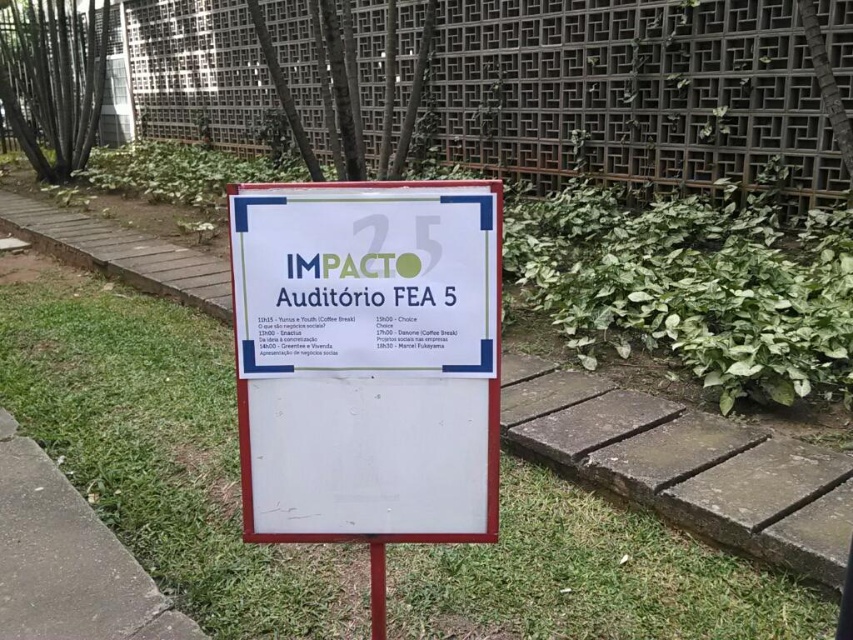
Question: Among these objects, which one is farthest from the camera?

Choices:
 (A) metallic grid fence at upper center
 (B) green grass at lower left
 (C) metallic red post at center
 (D) green grass at center

Answer: (A)

Question: Estimate the real-world distances between objects in this image. Which object is closer to the green grass at center?

Choices:
 (A) metallic grid fence at upper center
 (B) white paper sign at center

Answer: (B)

Question: Which point is farther from the camera taking this photo?

Choices:
 (A) (103, 621)
 (B) (640, 12)

Answer: (B)

Question: Does green grass at center appear over green grass at lower left?

Choices:
 (A) no
 (B) yes

Answer: (B)

Question: Does green grass at center have a lesser width compared to green grass at lower left?

Choices:
 (A) no
 (B) yes

Answer: (A)

Question: Can you confirm if green grass at center is bigger than metallic red post at center?

Choices:
 (A) yes
 (B) no

Answer: (A)